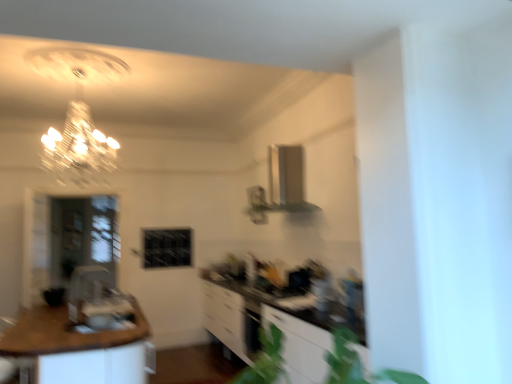
Question: Is brown wood countertop at lower left further to camera compared to transparent glass door at left?

Choices:
 (A) yes
 (B) no

Answer: (B)

Question: Considering the relative positions of brown wood countertop at lower left and transparent glass door at left in the image provided, is brown wood countertop at lower left in front of transparent glass door at left?

Choices:
 (A) yes
 (B) no

Answer: (A)

Question: Does brown wood countertop at lower left have a larger size compared to transparent glass door at left?

Choices:
 (A) no
 (B) yes

Answer: (B)

Question: Does brown wood countertop at lower left have a greater width compared to transparent glass door at left?

Choices:
 (A) yes
 (B) no

Answer: (A)

Question: From a real-world perspective, is brown wood countertop at lower left on transparent glass door at left?

Choices:
 (A) yes
 (B) no

Answer: (B)

Question: Is transparent glass door at left in front of or behind brown wood countertop at lower left in the image?

Choices:
 (A) front
 (B) behind

Answer: (B)

Question: Based on their sizes in the image, would you say transparent glass door at left is bigger or smaller than brown wood countertop at lower left?

Choices:
 (A) big
 (B) small

Answer: (B)

Question: Choose the correct answer: Is transparent glass door at left inside brown wood countertop at lower left or outside it?

Choices:
 (A) inside
 (B) outside

Answer: (B)

Question: In terms of height, does transparent glass door at left look taller or shorter compared to brown wood countertop at lower left?

Choices:
 (A) short
 (B) tall

Answer: (B)

Question: Is brown wood countertop at lower left wider or thinner than transparent glass door at left?

Choices:
 (A) wide
 (B) thin

Answer: (A)

Question: Does point (35, 306) appear closer or farther from the camera than point (68, 259)?

Choices:
 (A) farther
 (B) closer

Answer: (B)

Question: In the image, is brown wood countertop at lower left positioned in front of or behind transparent glass door at left?

Choices:
 (A) front
 (B) behind

Answer: (A)

Question: In terms of height, does brown wood countertop at lower left look taller or shorter compared to transparent glass door at left?

Choices:
 (A) short
 (B) tall

Answer: (A)

Question: Based on their sizes in the image, would you say white glossy cabinetry at center is bigger or smaller than brown wood countertop at lower left?

Choices:
 (A) big
 (B) small

Answer: (A)

Question: In the image, is white glossy cabinetry at center positioned in front of or behind brown wood countertop at lower left?

Choices:
 (A) front
 (B) behind

Answer: (B)